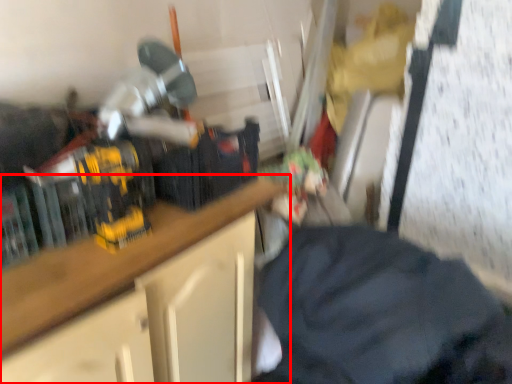
Question: In this image, where is cabinetry (annotated by the red box) located relative to clothing?

Choices:
 (A) right
 (B) left

Answer: (B)